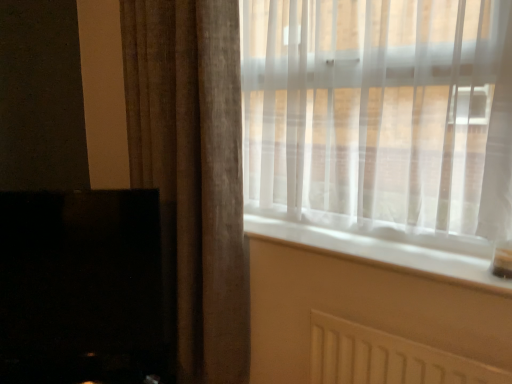
Question: Is brown textured curtain at left bigger than white smooth window sill at center?

Choices:
 (A) yes
 (B) no

Answer: (A)

Question: Can you confirm if brown textured curtain at left is thinner than white smooth window sill at center?

Choices:
 (A) yes
 (B) no

Answer: (A)

Question: Is brown textured curtain at left positioned far away from white smooth window sill at center?

Choices:
 (A) yes
 (B) no

Answer: (B)

Question: From the image's perspective, is brown textured curtain at left above white smooth window sill at center?

Choices:
 (A) no
 (B) yes

Answer: (B)

Question: Is brown textured curtain at left turned away from white smooth window sill at center?

Choices:
 (A) yes
 (B) no

Answer: (B)

Question: Considering the relative sizes of brown textured curtain at left and white smooth window sill at center in the image provided, is brown textured curtain at left wider than white smooth window sill at center?

Choices:
 (A) no
 (B) yes

Answer: (A)

Question: Is brown textured curtain at left located outside translucent fabric window at upper right?

Choices:
 (A) no
 (B) yes

Answer: (B)

Question: Considering the relative sizes of brown textured curtain at left and translucent fabric window at upper right in the image provided, is brown textured curtain at left wider than translucent fabric window at upper right?

Choices:
 (A) yes
 (B) no

Answer: (A)

Question: Does brown textured curtain at left appear on the left side of translucent fabric window at upper right?

Choices:
 (A) no
 (B) yes

Answer: (B)

Question: Is brown textured curtain at left surrounding translucent fabric window at upper right?

Choices:
 (A) yes
 (B) no

Answer: (B)

Question: From the image's perspective, is brown textured curtain at left on top of translucent fabric window at upper right?

Choices:
 (A) no
 (B) yes

Answer: (A)

Question: Considering the relative sizes of brown textured curtain at left and translucent fabric window at upper right in the image provided, is brown textured curtain at left thinner than translucent fabric window at upper right?

Choices:
 (A) no
 (B) yes

Answer: (A)

Question: Considering the relative sizes of translucent fabric window at upper right and white smooth window sill at center in the image provided, is translucent fabric window at upper right shorter than white smooth window sill at center?

Choices:
 (A) no
 (B) yes

Answer: (A)